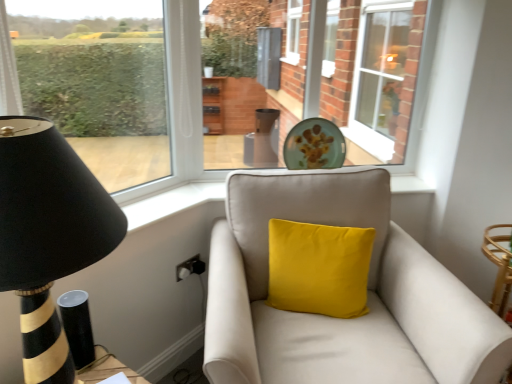
Question: Is black striped wood table lamp at left not close to matte glass plate at center?

Choices:
 (A) yes
 (B) no

Answer: (A)

Question: Can you confirm if black striped wood table lamp at left is positioned to the right of matte glass plate at center?

Choices:
 (A) yes
 (B) no

Answer: (B)

Question: Does black striped wood table lamp at left have a smaller size compared to matte glass plate at center?

Choices:
 (A) yes
 (B) no

Answer: (B)

Question: Is black striped wood table lamp at left beside matte glass plate at center?

Choices:
 (A) yes
 (B) no

Answer: (B)

Question: Is black striped wood table lamp at left wider than matte glass plate at center?

Choices:
 (A) no
 (B) yes

Answer: (B)

Question: Is black striped wood table lamp at left in front of matte glass plate at center?

Choices:
 (A) no
 (B) yes

Answer: (B)

Question: Does suede beige couch at center have a greater height compared to black striped wood table lamp at left?

Choices:
 (A) no
 (B) yes

Answer: (B)

Question: Would you say suede beige couch at center is a long distance from black striped wood table lamp at left?

Choices:
 (A) yes
 (B) no

Answer: (B)

Question: Is suede beige couch at center oriented away from black striped wood table lamp at left?

Choices:
 (A) no
 (B) yes

Answer: (A)

Question: Could you tell me if suede beige couch at center is facing black striped wood table lamp at left?

Choices:
 (A) yes
 (B) no

Answer: (B)

Question: From a real-world perspective, is suede beige couch at center on top of black striped wood table lamp at left?

Choices:
 (A) yes
 (B) no

Answer: (B)

Question: From the image's perspective, does suede beige couch at center appear higher than black striped wood table lamp at left?

Choices:
 (A) yes
 (B) no

Answer: (B)

Question: From the image's perspective, is suede beige couch at center above clear glass window at upper right, the second window positioned from the left?

Choices:
 (A) no
 (B) yes

Answer: (A)